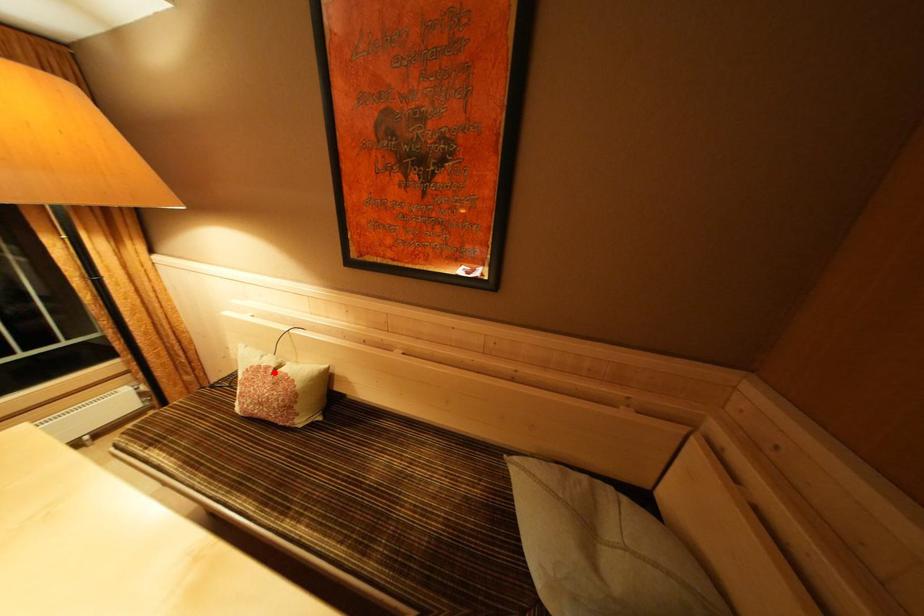
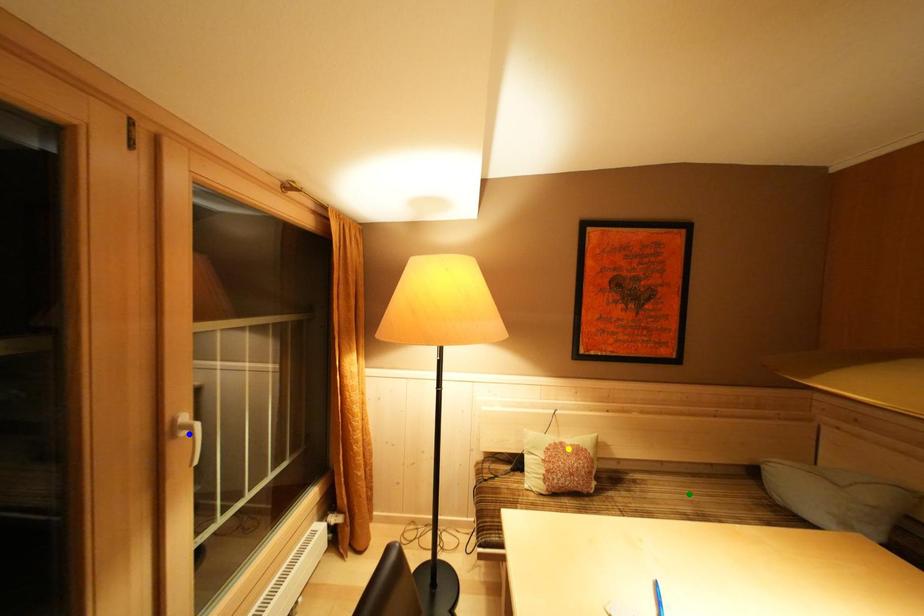
Question: I am providing you with two images of the same scene from different viewpoints. A red point is marked on the first image. You are given multiple points on the second image. Which spot in image 2 lines up with the point in image 1?

Choices:
 (A) green point
 (B) blue point
 (C) yellow point

Answer: (C)